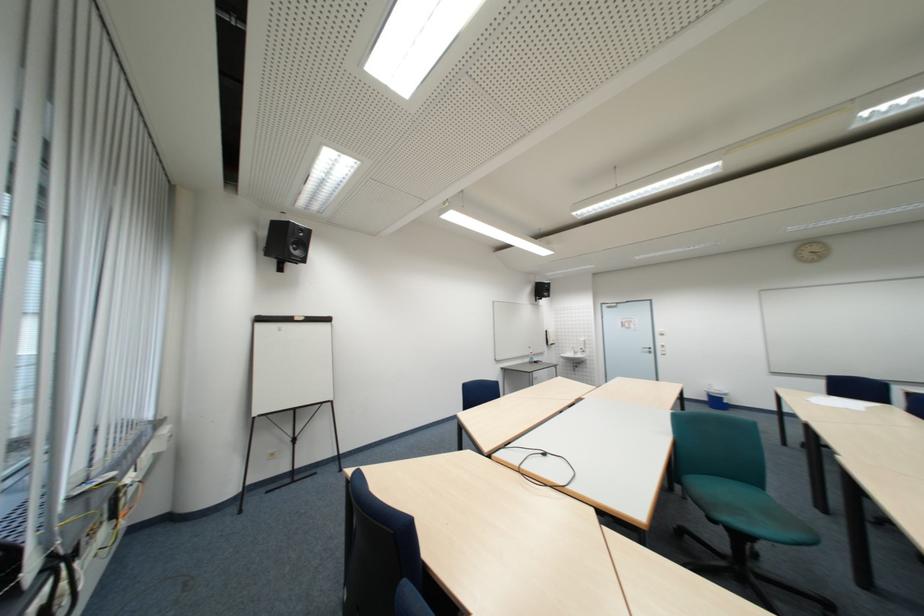
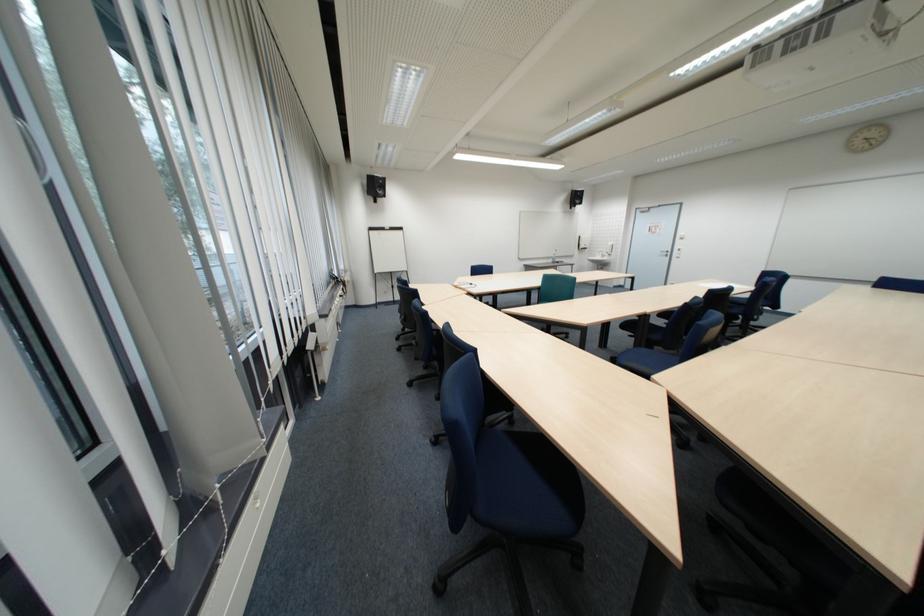
Which direction would the cameraman need to move to produce the second image?

Result: The cameraman walked toward right, backward.